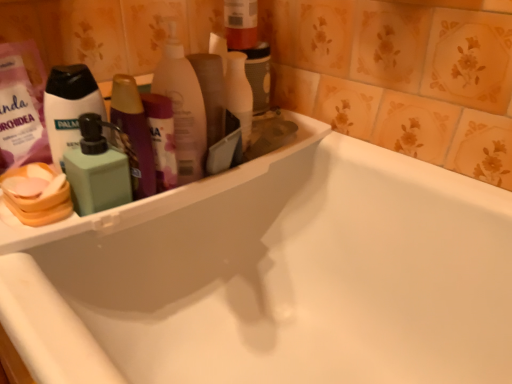
Where is `translucent plastic bottle at upper center, which is the first cleaning product in right-to-left order`? translucent plastic bottle at upper center, which is the first cleaning product in right-to-left order is located at coordinates (183, 107).

Find the location of `white glossy bathtub at upper left`. white glossy bathtub at upper left is located at coordinates (273, 276).

The image size is (512, 384). Find the location of `green matte soap dispenser at left, which is counted as the 2th cleaning product, starting from the right`. green matte soap dispenser at left, which is counted as the 2th cleaning product, starting from the right is located at coordinates (97, 169).

Does white glossy bathtub at upper left have a lesser width compared to green matte soap dispenser at left, which is counted as the 2th cleaning product, starting from the right?

In fact, white glossy bathtub at upper left might be wider than green matte soap dispenser at left, which is counted as the 2th cleaning product, starting from the right.

From a real-world perspective, is white glossy bathtub at upper left located higher than green matte soap dispenser at left, which is counted as the 2th cleaning product, starting from the right?

Incorrect, from a real-world perspective, white glossy bathtub at upper left is lower than green matte soap dispenser at left, which is counted as the 2th cleaning product, starting from the right.

There is a white glossy bathtub at upper left. Where is `the 1st cleaning product above it (from a real-world perspective)`? This screenshot has width=512, height=384. the 1st cleaning product above it (from a real-world perspective) is located at coordinates (97, 169).

Which object is further away from the camera, white glossy bathtub at upper left or green matte soap dispenser at left, which is counted as the 2th cleaning product, starting from the right?

green matte soap dispenser at left, which is counted as the 2th cleaning product, starting from the right, is more distant.

In terms of width, does white glossy bathtub at upper left look wider or thinner when compared to green matte pump bottle at left?

Result: Clearly, white glossy bathtub at upper left has more width compared to green matte pump bottle at left.

In the scene shown: Is white glossy bathtub at upper left further to camera compared to green matte pump bottle at left?

No.

From the picture: From a real-world perspective, relative to green matte pump bottle at left, is white glossy bathtub at upper left vertically above or below?

From a real-world perspective, white glossy bathtub at upper left is physically below green matte pump bottle at left.

In terms of size, does white glossy bathtub at upper left appear bigger or smaller than green matte pump bottle at left?

white glossy bathtub at upper left is bigger than green matte pump bottle at left.

How many degrees apart are the facing directions of green matte pump bottle at left and translucent plastic bottle at upper center, which is the second cleaning product from left to right?

They differ by 0.00342 degrees in their facing directions.

Considering the points (69, 104) and (188, 179), which point is in front, point (69, 104) or point (188, 179)?

The point (69, 104) is closer to the camera.

Which of these two, green matte pump bottle at left or translucent plastic bottle at upper center, which is the first cleaning product in right-to-left order, is thinner?

green matte pump bottle at left.

Is green matte pump bottle at left facing away from translucent plastic bottle at upper center, which is the first cleaning product in right-to-left order?

No, translucent plastic bottle at upper center, which is the first cleaning product in right-to-left order, is not at the back of green matte pump bottle at left.

Is green matte pump bottle at left far from white glossy bathtub at upper left?

No, green matte pump bottle at left is not far from white glossy bathtub at upper left.

From the image's perspective, is green matte pump bottle at left below white glossy bathtub at upper left?

No, from the image's perspective, green matte pump bottle at left is not beneath white glossy bathtub at upper left.

Could you tell me if green matte pump bottle at left is facing white glossy bathtub at upper left?

No, green matte pump bottle at left is not turned towards white glossy bathtub at upper left.

Considering the sizes of green matte pump bottle at left and white glossy bathtub at upper left in the image, is green matte pump bottle at left bigger or smaller than white glossy bathtub at upper left?

green matte pump bottle at left is smaller than white glossy bathtub at upper left.

Could you tell me if translucent plastic bottle at upper center, which is the first cleaning product in right-to-left order, is turned towards green matte pump bottle at left?

No, translucent plastic bottle at upper center, which is the first cleaning product in right-to-left order, is not facing towards green matte pump bottle at left.

Considering the relative positions of translucent plastic bottle at upper center, which is the second cleaning product from left to right, and green matte pump bottle at left in the image provided, is translucent plastic bottle at upper center, which is the second cleaning product from left to right, to the left of green matte pump bottle at left from the viewer's perspective?

No, translucent plastic bottle at upper center, which is the second cleaning product from left to right, is not to the left of green matte pump bottle at left.

Are translucent plastic bottle at upper center, which is the second cleaning product from left to right, and green matte pump bottle at left located far from each other?

No.

Who is smaller, translucent plastic bottle at upper center, which is the second cleaning product from left to right, or green matte pump bottle at left?

green matte pump bottle at left is smaller.

Measure the distance between green matte soap dispenser at left, which is counted as the 2th cleaning product, starting from the right, and white glossy bathtub at upper left.

They are 13.84 inches apart.

Which object is thinner, green matte soap dispenser at left, which is counted as the 2th cleaning product, starting from the right, or white glossy bathtub at upper left?

green matte soap dispenser at left, which is counted as the 2th cleaning product, starting from the right.

Considering the sizes of green matte soap dispenser at left, which ranks as the 1th cleaning product in left-to-right order, and white glossy bathtub at upper left in the image, is green matte soap dispenser at left, which ranks as the 1th cleaning product in left-to-right order, taller or shorter than white glossy bathtub at upper left?

In the image, green matte soap dispenser at left, which ranks as the 1th cleaning product in left-to-right order, appears to be shorter than white glossy bathtub at upper left.

Does green matte soap dispenser at left, which ranks as the 1th cleaning product in left-to-right order, turn towards translucent plastic bottle at upper center, which is the first cleaning product in right-to-left order?

No, green matte soap dispenser at left, which ranks as the 1th cleaning product in left-to-right order, does not turn towards translucent plastic bottle at upper center, which is the first cleaning product in right-to-left order.

From the image's perspective, is green matte soap dispenser at left, which ranks as the 1th cleaning product in left-to-right order, above translucent plastic bottle at upper center, which is the second cleaning product from left to right?

Incorrect, from the image's perspective, green matte soap dispenser at left, which ranks as the 1th cleaning product in left-to-right order, is lower than translucent plastic bottle at upper center, which is the second cleaning product from left to right.

Between green matte soap dispenser at left, which is counted as the 2th cleaning product, starting from the right, and translucent plastic bottle at upper center, which is the second cleaning product from left to right, which one has smaller size?

Smaller between the two is green matte soap dispenser at left, which is counted as the 2th cleaning product, starting from the right.

Is the depth of green matte soap dispenser at left, which is counted as the 2th cleaning product, starting from the right, less than that of translucent plastic bottle at upper center, which is the second cleaning product from left to right?

Yes, it is in front of translucent plastic bottle at upper center, which is the second cleaning product from left to right.

This screenshot has width=512, height=384. What are the coordinates of `bathtub below the green matte soap dispenser at left, which is counted as the 2th cleaning product, starting from the right (from the image's perspective)` in the screenshot? It's located at (273, 276).

I want to click on bathtub in front of the green matte pump bottle at left, so click(273, 276).

Consider the image. Considering their positions, is translucent plastic bottle at upper center, which is the first cleaning product in right-to-left order, positioned closer to green matte soap dispenser at left, which is counted as the 2th cleaning product, starting from the right, than green matte pump bottle at left?

Based on the image, green matte pump bottle at left appears to be nearer to green matte soap dispenser at left, which is counted as the 2th cleaning product, starting from the right.

When comparing their distances from green matte pump bottle at left, does green matte soap dispenser at left, which is counted as the 2th cleaning product, starting from the right, or translucent plastic bottle at upper center, which is the second cleaning product from left to right, seem further?

translucent plastic bottle at upper center, which is the second cleaning product from left to right, lies further to green matte pump bottle at left than the other object.

Consider the image. Looking at the image, which one is located further to green matte soap dispenser at left, which is counted as the 2th cleaning product, starting from the right, green matte pump bottle at left or translucent plastic bottle at upper center, which is the first cleaning product in right-to-left order?

translucent plastic bottle at upper center, which is the first cleaning product in right-to-left order, lies further to green matte soap dispenser at left, which is counted as the 2th cleaning product, starting from the right, than the other object.

When comparing their distances from white glossy bathtub at upper left, does translucent plastic bottle at upper center, which is the first cleaning product in right-to-left order, or green matte soap dispenser at left, which is counted as the 2th cleaning product, starting from the right, seem closer?

Among the two, translucent plastic bottle at upper center, which is the first cleaning product in right-to-left order, is located nearer to white glossy bathtub at upper left.

Considering their positions, is green matte soap dispenser at left, which is counted as the 2th cleaning product, starting from the right, positioned closer to translucent plastic bottle at upper center, which is the first cleaning product in right-to-left order, than white glossy bathtub at upper left?

Based on the image, green matte soap dispenser at left, which is counted as the 2th cleaning product, starting from the right, appears to be nearer to translucent plastic bottle at upper center, which is the first cleaning product in right-to-left order.

Which object lies nearer to the anchor point white glossy bathtub at upper left, green matte soap dispenser at left, which ranks as the 1th cleaning product in left-to-right order, or translucent plastic bottle at upper center, which is the first cleaning product in right-to-left order?

translucent plastic bottle at upper center, which is the first cleaning product in right-to-left order, is positioned closer to the anchor white glossy bathtub at upper left.

Considering their positions, is green matte pump bottle at left positioned further to white glossy bathtub at upper left than translucent plastic bottle at upper center, which is the first cleaning product in right-to-left order?

Based on the image, green matte pump bottle at left appears to be further to white glossy bathtub at upper left.

Based on their spatial positions, is white glossy bathtub at upper left or translucent plastic bottle at upper center, which is the first cleaning product in right-to-left order, further from green matte pump bottle at left?

The object further to green matte pump bottle at left is white glossy bathtub at upper left.

I want to click on cleaning product between green matte pump bottle at left and translucent plastic bottle at upper center, which is the first cleaning product in right-to-left order, so click(x=97, y=169).

Find the location of `cleaning product between white glossy bathtub at upper left and green matte pump bottle at left along the z-axis`. cleaning product between white glossy bathtub at upper left and green matte pump bottle at left along the z-axis is located at coordinates (97, 169).

Image resolution: width=512 pixels, height=384 pixels. Find the location of `cleaning product that lies between translucent plastic bottle at upper center, which is the first cleaning product in right-to-left order, and white glossy bathtub at upper left from top to bottom`. cleaning product that lies between translucent plastic bottle at upper center, which is the first cleaning product in right-to-left order, and white glossy bathtub at upper left from top to bottom is located at coordinates (97, 169).

I want to click on toiletry between translucent plastic bottle at upper center, which is the first cleaning product in right-to-left order, and white glossy bathtub at upper left from top to bottom, so click(x=69, y=107).